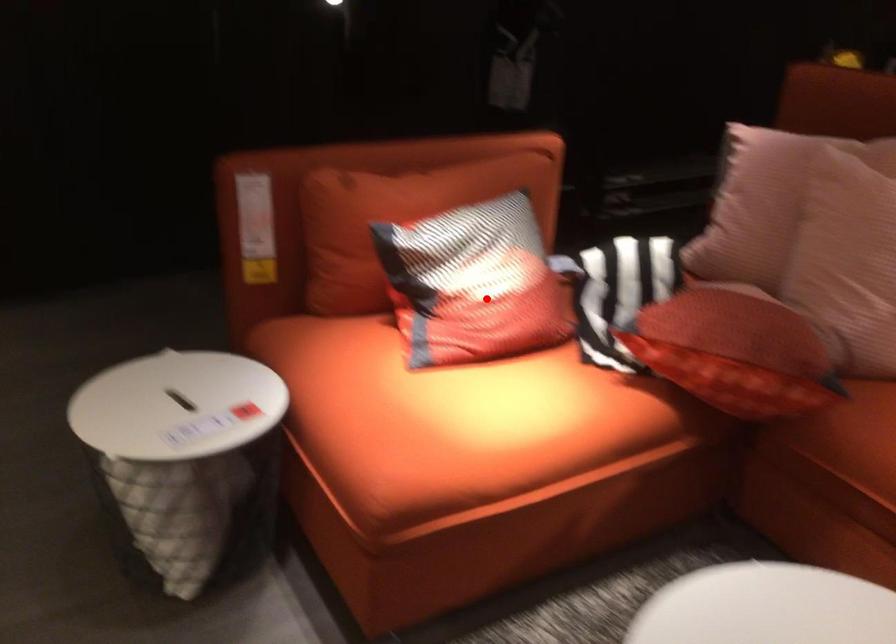
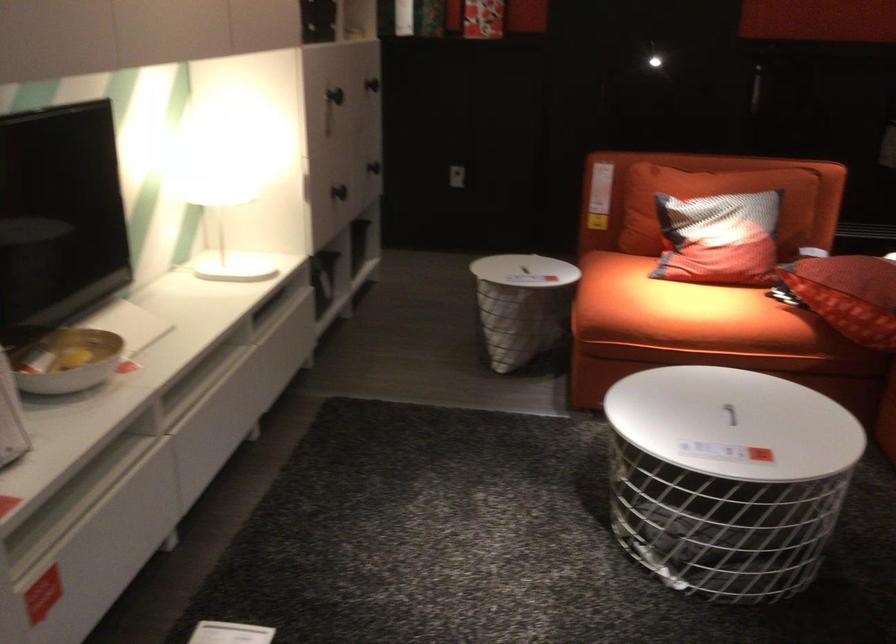
Find the pixel in the second image that matches the highlighted location in the first image.

(719, 239)